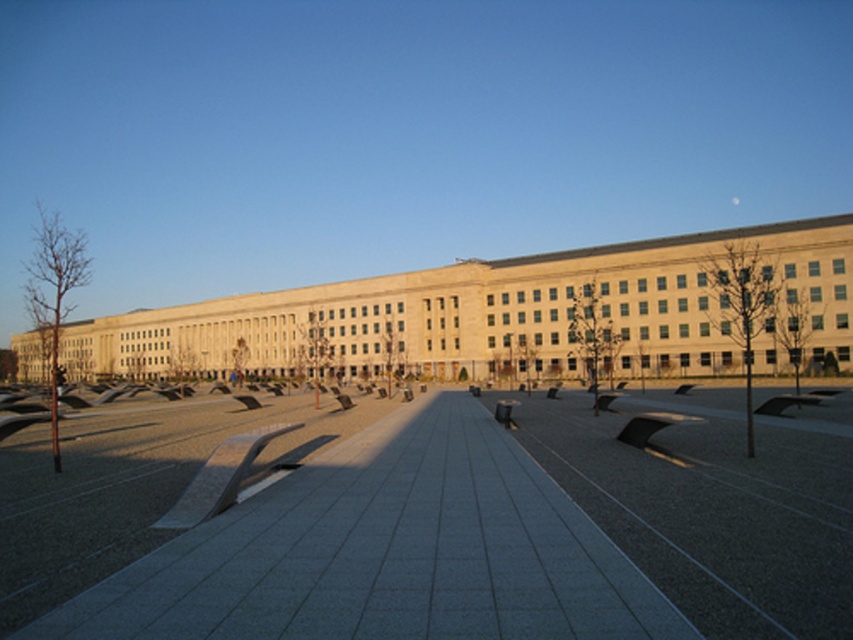
Question: Does smooth concrete skate park at center appear on the left side of beige stone plaza at center?

Choices:
 (A) no
 (B) yes

Answer: (A)

Question: Is smooth concrete skate park at center positioned in front of beige stone plaza at center?

Choices:
 (A) yes
 (B) no

Answer: (A)

Question: Is smooth concrete skate park at center positioned at the back of beige stone plaza at center?

Choices:
 (A) no
 (B) yes

Answer: (A)

Question: Which of the following is the farthest from the observer?

Choices:
 (A) (428, 285)
 (B) (726, 625)

Answer: (A)

Question: Which object is farther from the camera taking this photo?

Choices:
 (A) smooth concrete skate park at center
 (B) beige stone plaza at center

Answer: (B)

Question: Among these objects, which one is farthest from the camera?

Choices:
 (A) beige stone plaza at center
 (B) smooth concrete skate park at center

Answer: (A)